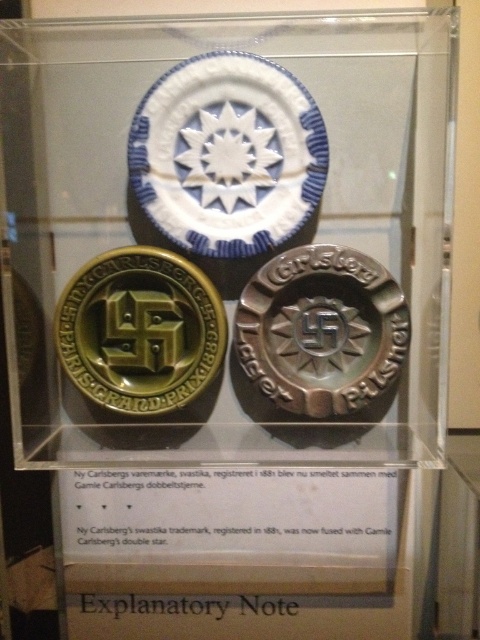
You are a historian examining the display case. You need to determine which object is bigger between the brushed metal badge at center and the gold matte swastika at left. Which one is larger?

The brushed metal badge at center is larger in size than the gold matte swastika at left.

You are a museum curator examining the display case. You need to place a protective cover over the gold matte swastika at left. Which direction should you move the cover from the brushed metal badge at center to reach it?

The gold matte swastika at left is located to the left of the brushed metal badge at center. To reach it, move the cover to the left from the brushed metal badge at center.